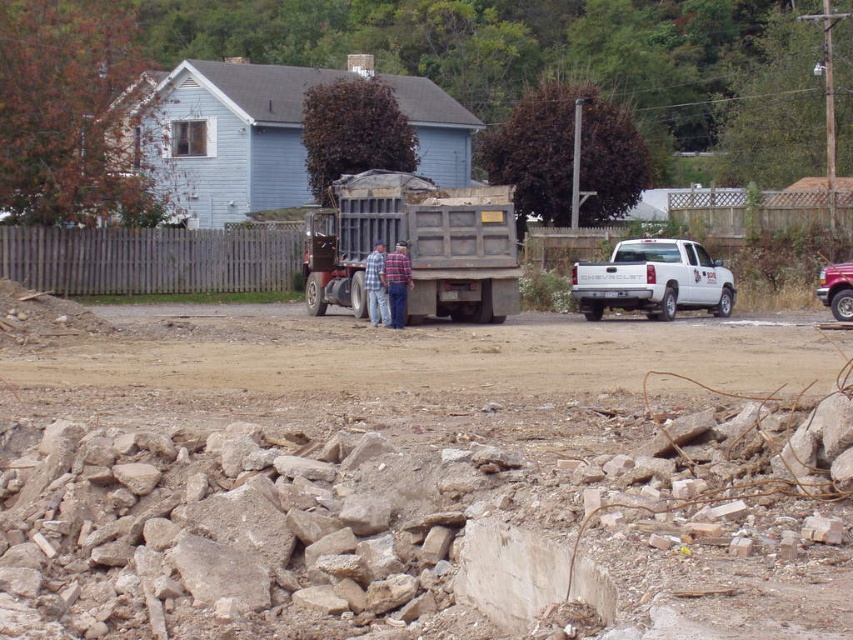
You are a construction worker standing at the point with coordinates point (416, 244). What object are you standing on?

You are standing on the gray metallic dump truck at center marked by point (416, 244).

You are a construction worker trying to move a heavy tool from one side of the brown dirt field at center to the other. Considering the plaid shirt at center is in the middle, can you walk around it without stepping off the field?

The brown dirt field at center is wider than the plaid shirt at center, so yes, you can walk around the plaid shirt at center while staying on the field.